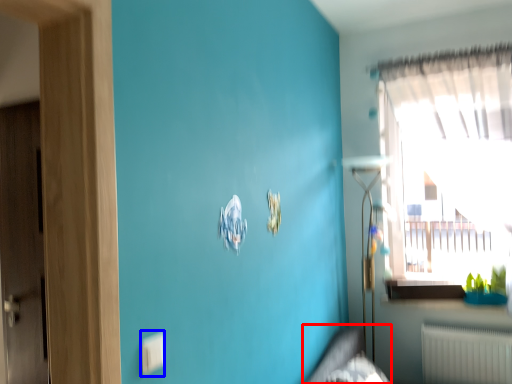
Question: Which object is further to the camera taking this photo, bed frame (highlighted by a red box) or electric outlet (highlighted by a blue box)?

Choices:
 (A) bed frame
 (B) electric outlet

Answer: (A)